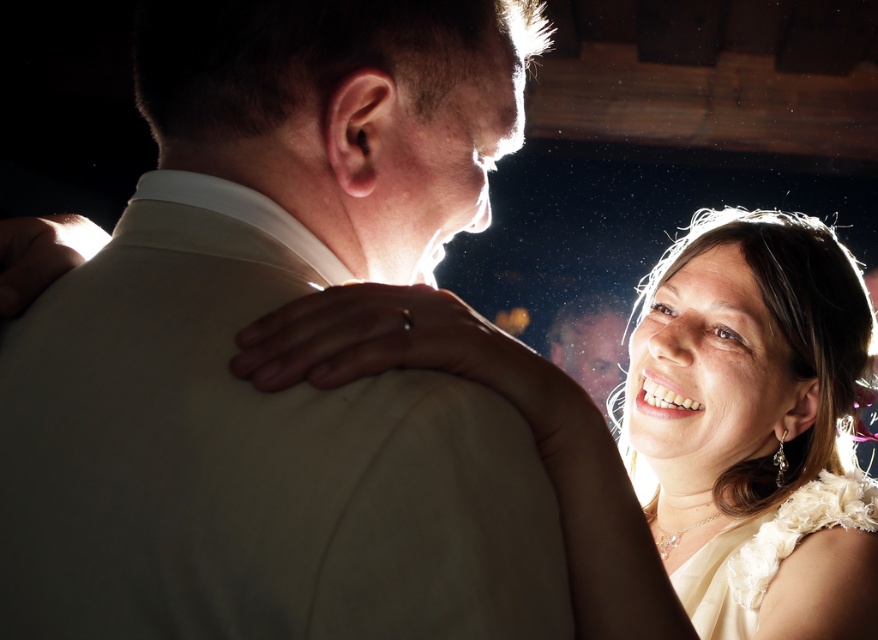
What is the color of the clothing item located at the coordinates point (258, 316) in the image?

The point (258, 316) corresponds to the matte white suit at center, so the color is white.

You are at a wedding reception and want to take a photo of the matte white suit at center and the white satin dress at center. Since the camera can only focus on one subject at a time, which one should you aim for first if you want to capture both in the frame?

You should aim for the matte white suit at center first since it is to the left of the white satin dress at center, allowing you to adjust the camera to include both in the frame.